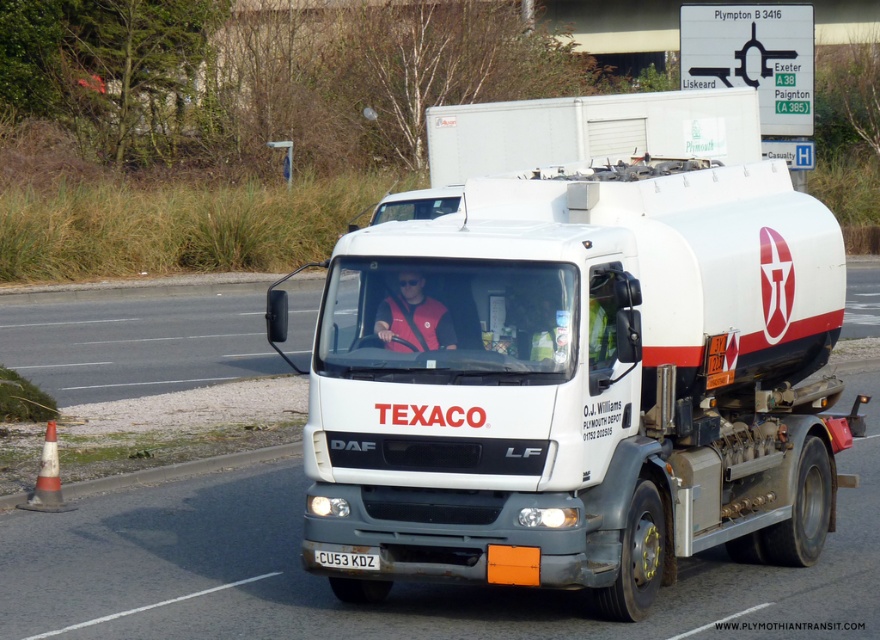
You are a safety inspector checking the visibility of safety gear on the truck. The red fabric vest at center and the white plastic license plate at center must both be visible from a distance. Which one is larger in size?

The red fabric vest at center is bigger than the white plastic license plate at center, so the vest is more visible from a distance.

Based on the photo, you are a safety inspector checking the distance between the white matte tanker truck at center and the red fabric vest at center. According to regulations, the minimum safe distance between a tanker truck and any loose object inside the cab should be at least 1.2 meters. Is the current distance compliant with the safety regulations?

The white matte tanker truck at center is 1.02 meters away from the red fabric vest at center. Since the required minimum distance is 1.2 meters, the current distance of 1.02 meters is below the required safety standard, so it is not compliant.